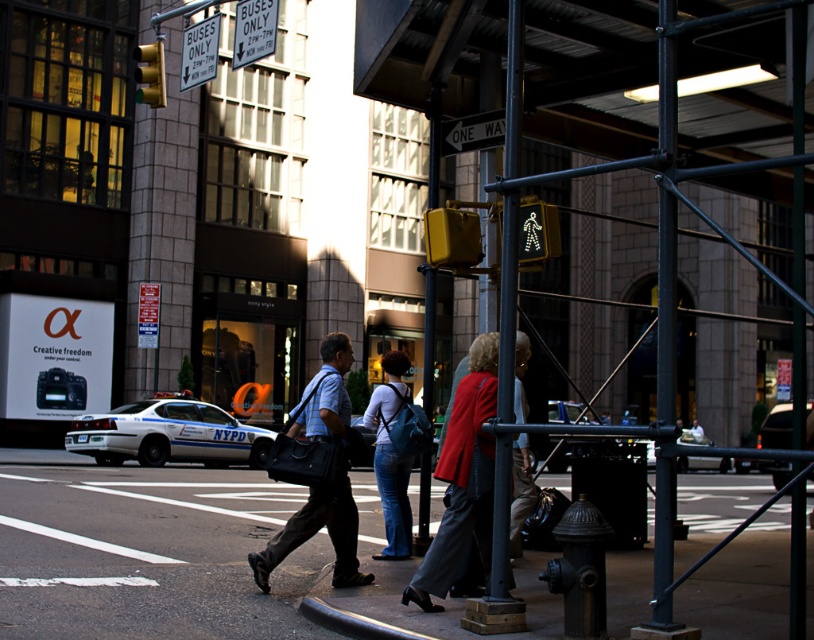
Is point (331, 396) positioned after point (580, 580)?

That is True.

Can you confirm if matte black bag at center is positioned above dark gray metal fire hydrant at lower right?

Indeed, matte black bag at center is positioned over dark gray metal fire hydrant at lower right.

Who is more forward, (252, 552) or (567, 544)?

Positioned in front is point (567, 544).

This screenshot has height=640, width=814. Identify the location of matte black bag at center. (316, 531).

The height and width of the screenshot is (640, 814). I want to click on matte red coat at center, so click(462, 481).

Between matte red coat at center and black metal pole at center, which one is positioned lower?

matte red coat at center

The height and width of the screenshot is (640, 814). I want to click on matte red coat at center, so click(462, 481).

Who is positioned more to the left, matte red coat at center or denim jeans at center?

denim jeans at center is more to the left.

The width and height of the screenshot is (814, 640). Describe the element at coordinates (462, 481) in the screenshot. I see `matte red coat at center` at that location.

Does point (458, 476) come farther from viewer compared to point (399, 365)?

No.

You are a GUI agent. You are given a task and a screenshot of the screen. Output one action in this format:
    pyautogui.click(x=<x>, y=<y>)
    Task: Click on the matte red coat at center
    Image resolution: width=814 pixels, height=640 pixels.
    Given the screenshot: What is the action you would take?
    pyautogui.click(x=462, y=481)